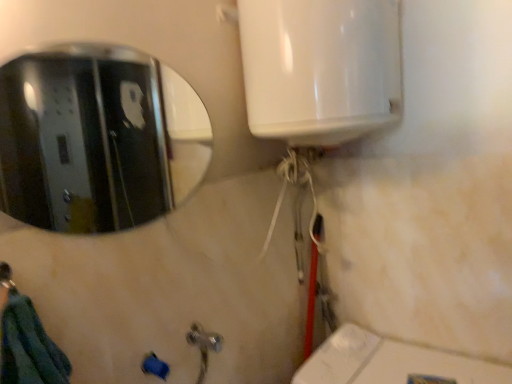
Image resolution: width=512 pixels, height=384 pixels. What do you see at coordinates (6, 277) in the screenshot? I see `brushed metal shower at lower left` at bounding box center [6, 277].

Identify the location of brushed metal shower at lower left. (6, 277).

What is the approximate height of polished metallic mirror at upper left?

polished metallic mirror at upper left is 38.67 centimeters in height.

The width and height of the screenshot is (512, 384). What do you see at coordinates (97, 138) in the screenshot?
I see `polished metallic mirror at upper left` at bounding box center [97, 138].

What is the approximate width of polished metallic mirror at upper left?

polished metallic mirror at upper left is 0.39 inches wide.

Identify the location of polished metallic mirror at upper left. This screenshot has height=384, width=512. coord(97,138).

In order to click on brushed metal shower at lower left in this screenshot , I will do `click(6, 277)`.

Looking at this image, is polished metallic mirror at upper left to the left or to the right of brushed metal shower at lower left in the image?

Clearly, polished metallic mirror at upper left is on the right of brushed metal shower at lower left in the image.

In the image, is polished metallic mirror at upper left positioned in front of or behind brushed metal shower at lower left?

Visually, polished metallic mirror at upper left is located behind brushed metal shower at lower left.

Considering the positions of point (196, 159) and point (8, 267), is point (196, 159) closer or farther from the camera than point (8, 267)?

Point (196, 159) is farther from the camera than point (8, 267).

From the image's perspective, is polished metallic mirror at upper left above or below brushed metal shower at lower left?

Clearly, from the image's perspective, polished metallic mirror at upper left is above brushed metal shower at lower left.

From a real-world perspective, is polished metallic mirror at upper left above or below brushed metal shower at lower left?

polished metallic mirror at upper left is above brushed metal shower at lower left.

Which of these two, polished metallic mirror at upper left or brushed metal shower at lower left, is wider?

Wider between the two is brushed metal shower at lower left.

Can you confirm if polished metallic mirror at upper left is shorter than brushed metal shower at lower left?

No.

Can you confirm if polished metallic mirror at upper left is bigger than brushed metal shower at lower left?

Yes, polished metallic mirror at upper left is bigger than brushed metal shower at lower left.

Is polished metallic mirror at upper left situated inside brushed metal shower at lower left or outside?

polished metallic mirror at upper left is not enclosed by brushed metal shower at lower left.

Is polished metallic mirror at upper left far away from brushed metal shower at lower left?

polished metallic mirror at upper left is far away from brushed metal shower at lower left.

Is polished metallic mirror at upper left oriented towards brushed metal shower at lower left?

No, polished metallic mirror at upper left is not oriented towards brushed metal shower at lower left.

Looking at this image, how different are the orientations of polished metallic mirror at upper left and brushed metal shower at lower left in degrees?

1.29 degrees separate the facing orientations of polished metallic mirror at upper left and brushed metal shower at lower left.

Where is `shower that is in front of the polished metallic mirror at upper left`? shower that is in front of the polished metallic mirror at upper left is located at coordinates (6, 277).

Looking at this image, between brushed metal shower at lower left and polished metallic mirror at upper left, which one appears on the left side from the viewer's perspective?

From the viewer's perspective, brushed metal shower at lower left appears more on the left side.

Who is more distant, brushed metal shower at lower left or polished metallic mirror at upper left?

polished metallic mirror at upper left is further from the camera.

Considering the positions of points (11, 277) and (149, 120), is point (11, 277) farther from camera compared to point (149, 120)?

No, (11, 277) is closer to viewer.

From the image's perspective, is brushed metal shower at lower left located beneath polished metallic mirror at upper left?

Yes, from the image's perspective, brushed metal shower at lower left is beneath polished metallic mirror at upper left.

From a real-world perspective, is brushed metal shower at lower left above or below polished metallic mirror at upper left?

In terms of real-world spatial position, brushed metal shower at lower left is below polished metallic mirror at upper left.

Which object is thinner, brushed metal shower at lower left or polished metallic mirror at upper left?

polished metallic mirror at upper left is thinner.

Considering the sizes of objects brushed metal shower at lower left and polished metallic mirror at upper left in the image provided, who is shorter, brushed metal shower at lower left or polished metallic mirror at upper left?

With less height is brushed metal shower at lower left.

Who is bigger, brushed metal shower at lower left or polished metallic mirror at upper left?

polished metallic mirror at upper left.

Would you say brushed metal shower at lower left is outside polished metallic mirror at upper left?

brushed metal shower at lower left is positioned outside polished metallic mirror at upper left.

Are brushed metal shower at lower left and polished metallic mirror at upper left located far from each other?

That's right, there is a large distance between brushed metal shower at lower left and polished metallic mirror at upper left.

Could you tell me if brushed metal shower at lower left is turned towards polished metallic mirror at upper left?

No, brushed metal shower at lower left is not aimed at polished metallic mirror at upper left.

How different are the orientations of brushed metal shower at lower left and polished metallic mirror at upper left in degrees?

They differ by 1.29 degrees in their facing directions.

At what (x,y) coordinates should I click in order to perform the action: click on shower located on the left of polished metallic mirror at upper left. Please return your answer as a coordinate pair (x, y). Looking at the image, I should click on (6, 277).

I want to click on shower to the left of polished metallic mirror at upper left, so click(6, 277).

Identify the location of mirror above the brushed metal shower at lower left (from the image's perspective). Image resolution: width=512 pixels, height=384 pixels. (97, 138).